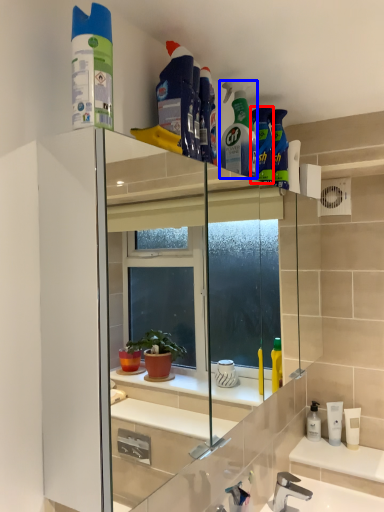
Question: Which object is closer to the camera taking this photo, cleaning product (highlighted by a red box) or cleaning product (highlighted by a blue box)?

Choices:
 (A) cleaning product
 (B) cleaning product

Answer: (B)